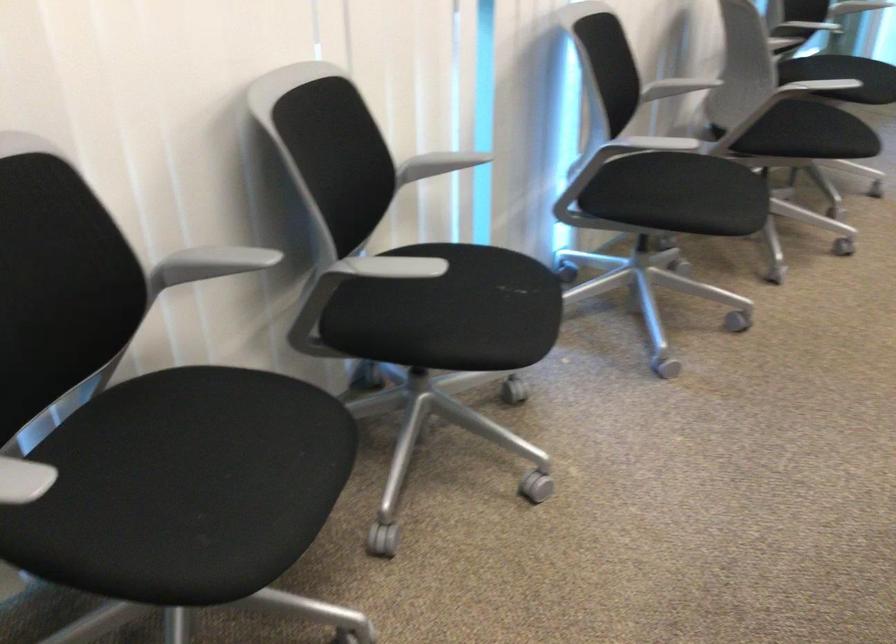
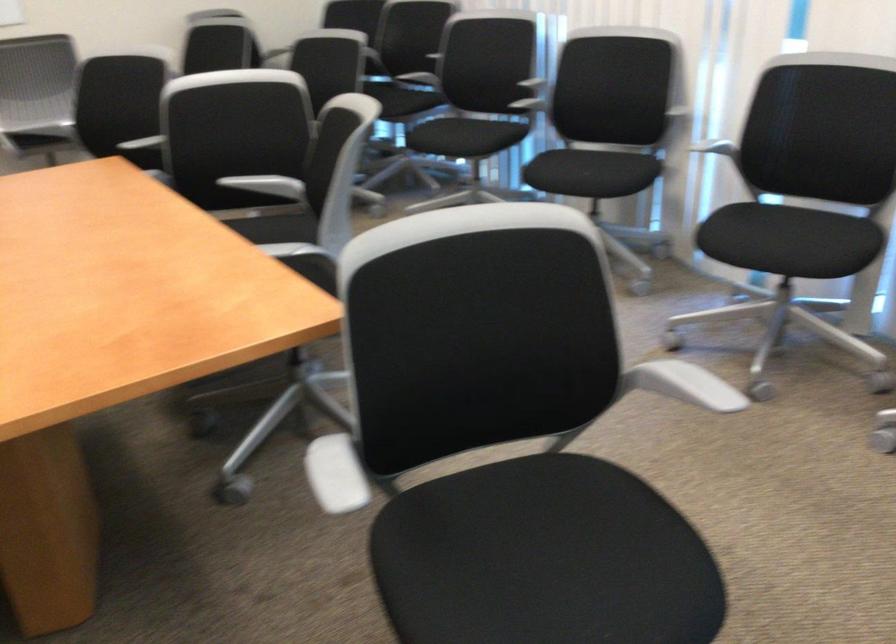
Question: I am providing you with two images of the same scene from different viewpoints. After the viewpoint changes to image2, which objects are now occluded?

Choices:
 (A) black chair sitting surface
 (B) white chair armrest
 (C) metal table latch
 (D) grey chair armrest

Answer: (D)